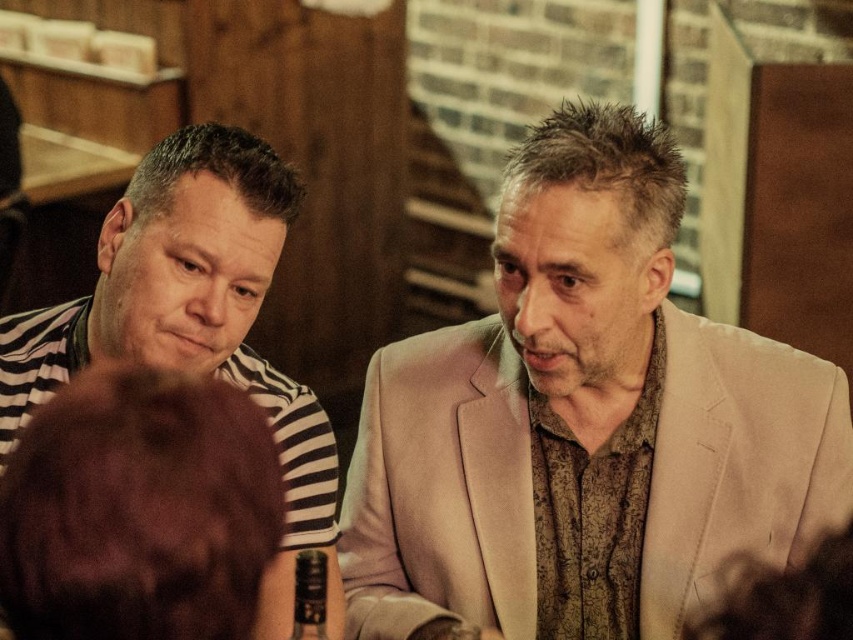
Question: Which object appears farthest from the camera in this image?

Choices:
 (A) light beige suit at center
 (B) dark brown fur at lower left
 (C) striped fabric shirt at left

Answer: (A)

Question: Which point is farther to the camera?

Choices:
 (A) light beige suit at center
 (B) striped fabric shirt at left
 (C) dark brown fur at lower left

Answer: (A)

Question: Which object appears farthest from the camera in this image?

Choices:
 (A) light beige suit at center
 (B) dark brown fur at lower left

Answer: (A)

Question: Where is light beige suit at center located in relation to dark brown fur at lower left in the image?

Choices:
 (A) left
 (B) right

Answer: (B)

Question: Is light beige suit at center further to the viewer compared to dark brown fur at lower left?

Choices:
 (A) no
 (B) yes

Answer: (B)

Question: Is dark brown fur at lower left below striped fabric shirt at left?

Choices:
 (A) yes
 (B) no

Answer: (B)